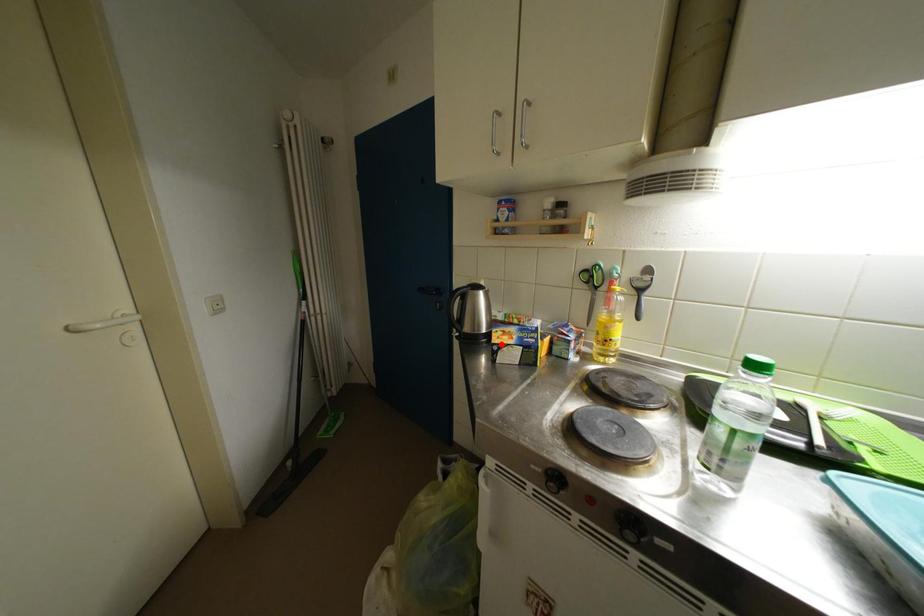
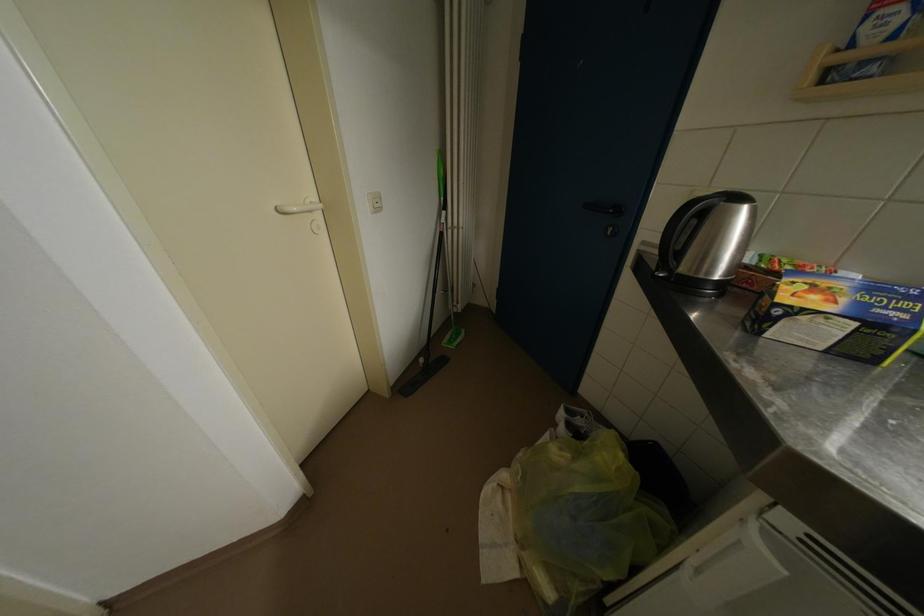
Locate, in the second image, the point that corresponds to the highlighted location in the first image.

(791, 302)